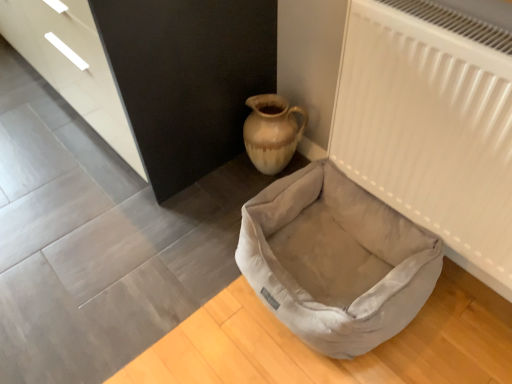
Find the location of a particular element. The width and height of the screenshot is (512, 384). free location to the left of matte beige ceramic vase at upper left is located at coordinates (230, 177).